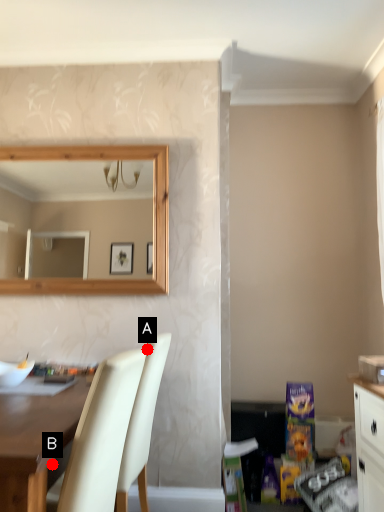
Question: Two points are circled on the image, labeled by A and B beside each circle. Which point is closer to the camera?

Choices:
 (A) A is closer
 (B) B is closer

Answer: (B)